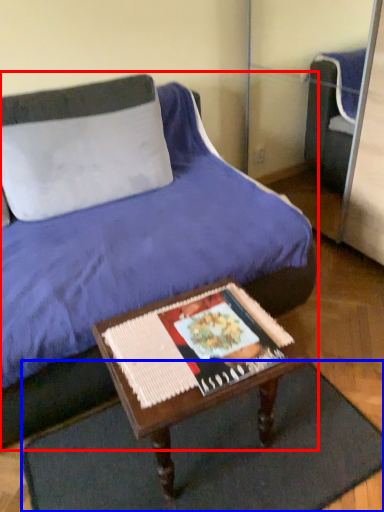
Question: Which point is closer to the camera, bed (highlighted by a red box) or doormat (highlighted by a blue box)?

Choices:
 (A) bed
 (B) doormat

Answer: (A)